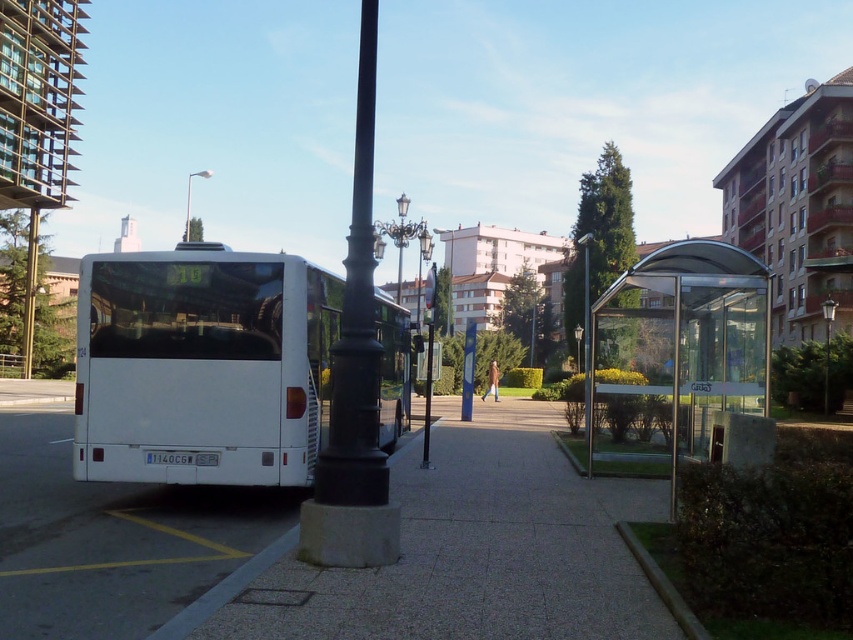
You are a pedestrian standing at the bus stop. You need to step onto the gray concrete curb at lower right to avoid a puddle. Is the metallic pole at upper center in your way when you move towards the curb?

The gray concrete curb at lower right is closer to the viewer than the metallic pole at upper center, so the metallic pole at upper center is behind the curb and not in your way when moving toward it.

You are a delivery person carrying a box that is 2 meters long. You need to place it on the smooth concrete pavement at center near the white matte bus at left. Is there enough space between them to place the box without it overlapping the bus?

The smooth concrete pavement at center is 1.89 meters away from the white matte bus at left. Since the box is 2 meters long, it will overlap the bus by 0.11 meters. Therefore, there isn not enough space to place the box without overlapping.

Based on the scene description, what object is located at the coordinates point (467, 550)?

The smooth concrete pavement at center is located at point (467, 550).